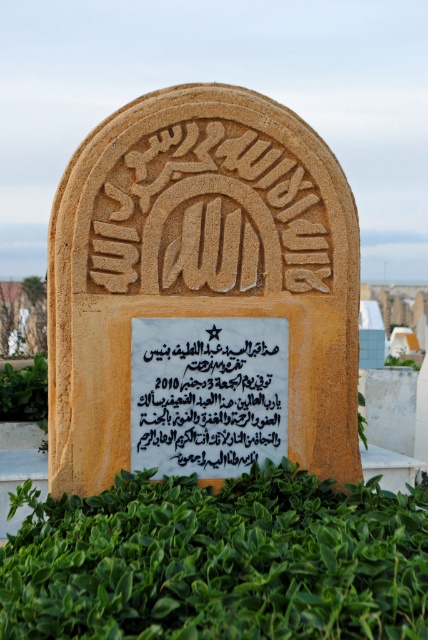
Does sandstone gravestone at center have a larger size compared to black paper text at center?

Correct, sandstone gravestone at center is larger in size than black paper text at center.

Is sandstone gravestone at center thinner than black paper text at center?

In fact, sandstone gravestone at center might be wider than black paper text at center.

Where is `sandstone gravestone at center`? This screenshot has height=640, width=428. sandstone gravestone at center is located at coordinates (202, 294).

Identify the location of sandstone gravestone at center. The image size is (428, 640). (202, 294).

Can you confirm if green leafy hedge at lower center is shorter than black paper text at center?

Correct, green leafy hedge at lower center is not as tall as black paper text at center.

What do you see at coordinates (217, 561) in the screenshot? I see `green leafy hedge at lower center` at bounding box center [217, 561].

Is point (376, 525) positioned before point (208, 336)?

Yes, it is.

Locate an element on the screen. The image size is (428, 640). green leafy hedge at lower center is located at coordinates (217, 561).

Can you confirm if sandstone gravestone at center is smaller than green leafy hedge at lower left?

No.

The height and width of the screenshot is (640, 428). I want to click on sandstone gravestone at center, so click(202, 294).